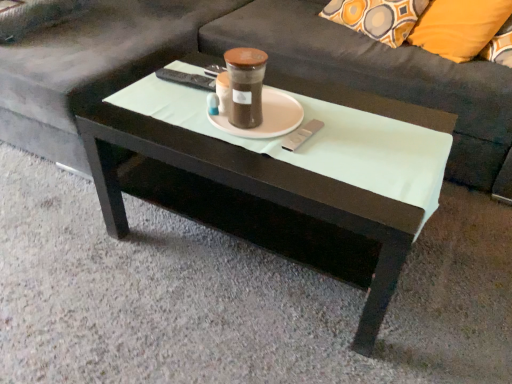
Image resolution: width=512 pixels, height=384 pixels. I want to click on empty space that is ontop of white glossy coffee table at center (from a real-world perspective), so click(x=295, y=127).